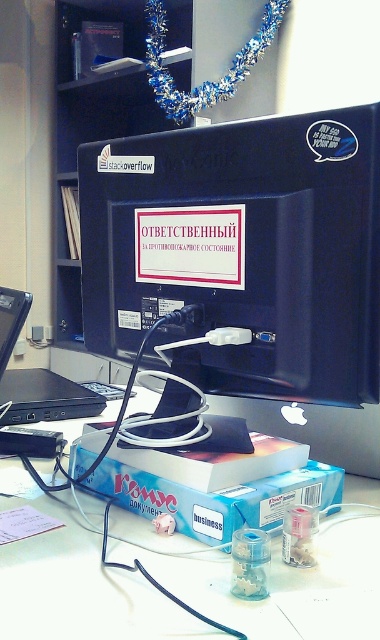
Question: Does matte black monitor at center appear on the left side of white plastic computer desk at center?

Choices:
 (A) no
 (B) yes

Answer: (A)

Question: Which of the following is the closest to the observer?

Choices:
 (A) white plastic computer desk at center
 (B) matte black monitor at center

Answer: (A)

Question: Is matte black monitor at center positioned in front of white plastic computer desk at center?

Choices:
 (A) no
 (B) yes

Answer: (A)

Question: Is matte black monitor at center bigger than white plastic computer desk at center?

Choices:
 (A) yes
 (B) no

Answer: (A)

Question: Which point is farther from the camera taking this photo?

Choices:
 (A) (101, 348)
 (B) (101, 612)

Answer: (A)